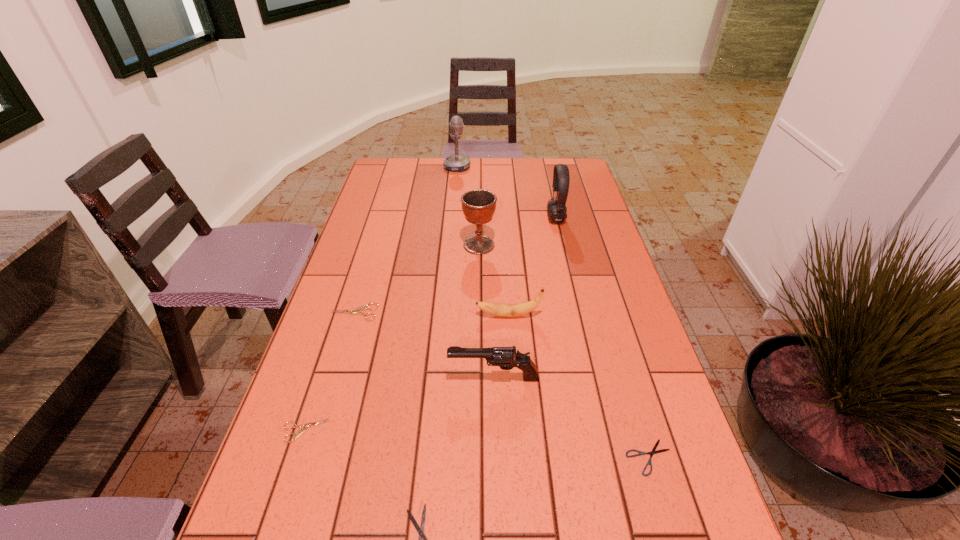
Where is `the rightmost shears`? The height and width of the screenshot is (540, 960). the rightmost shears is located at coordinates (653, 451).

Locate an element on the screen. The height and width of the screenshot is (540, 960). the right black shears is located at coordinates coord(653,451).

You are a GUI agent. You are given a task and a screenshot of the screen. Output one action in this format:
    pyautogui.click(x=<x>, y=<y>)
    Task: Click on the vacant point located on the front-facing side of the farthest object
    
    Given the screenshot: What is the action you would take?
    pyautogui.click(x=483, y=167)

The height and width of the screenshot is (540, 960). I want to click on vacant space situated on the front-facing side of the second farthest object, so click(x=529, y=219).

The height and width of the screenshot is (540, 960). I want to click on free space located on the front-facing side of the second farthest object, so click(x=478, y=219).

Locate an element on the screen. The image size is (960, 540). vacant space located on the front-facing side of the second farthest object is located at coordinates (481, 219).

Image resolution: width=960 pixels, height=540 pixels. I want to click on vacant space located 0.220m on the back of the chalice, so click(479, 199).

I want to click on vacant space located at the end of the barrel of the fourth nearest object, so click(324, 378).

Find the location of a particular element. vacant space situated at the end of the barrel of the fourth nearest object is located at coordinates (382, 378).

The width and height of the screenshot is (960, 540). What are the coordinates of `vacant point located at the end of the barrel of the fourth nearest object` in the screenshot? It's located at [365, 378].